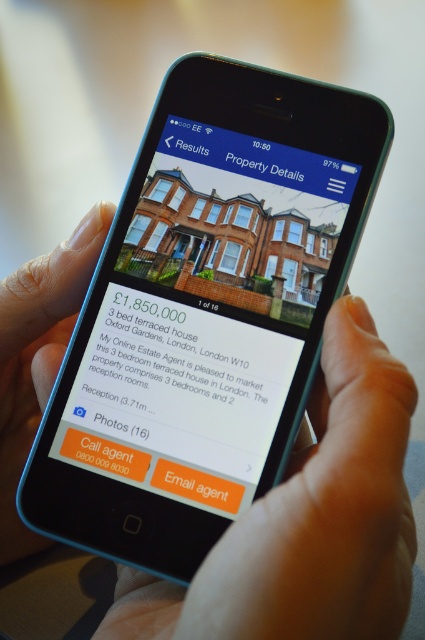
Based on the scene description, where is the smooth skin hand at lower right located?

The smooth skin hand at lower right is located at point (308,520).